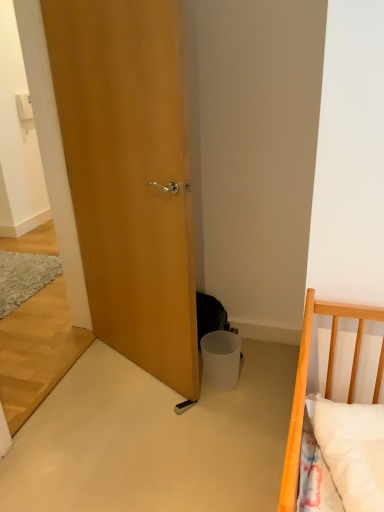
Find the location of a particular element. This screenshot has height=512, width=384. vacant area located to the right-hand side of white matte trash bin at lower center is located at coordinates (258, 379).